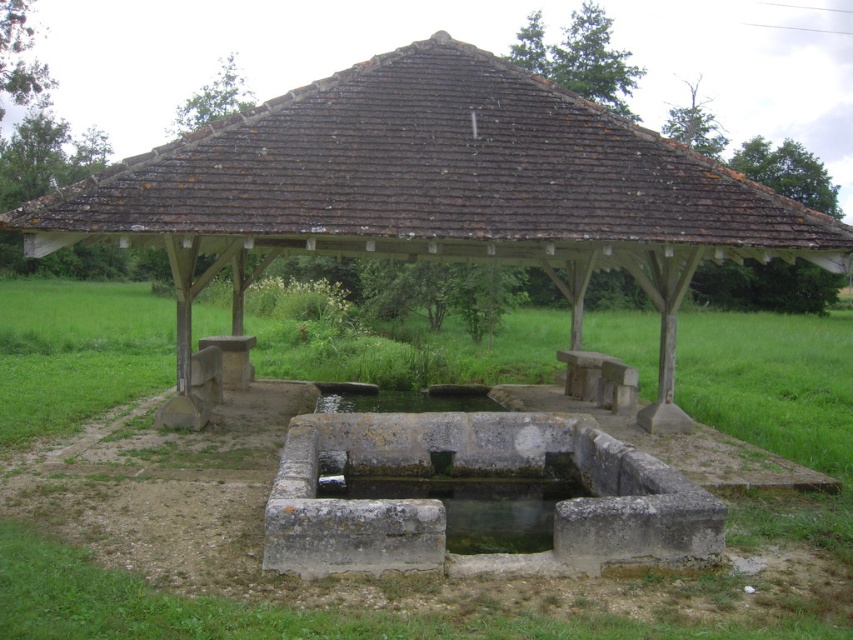
Who is positioned more to the right, stone roofed hut at center or green grass at center?

stone roofed hut at center

Between point (741, 176) and point (274, 324), which one is positioned in front?

Positioned in front is point (741, 176).

The image size is (853, 640). Describe the element at coordinates (434, 193) in the screenshot. I see `stone roofed hut at center` at that location.

You are a GUI agent. You are given a task and a screenshot of the screen. Output one action in this format:
    pyautogui.click(x=<x>, y=<y>)
    Task: Click on the stone roofed hut at center
    
    Given the screenshot: What is the action you would take?
    pyautogui.click(x=434, y=193)